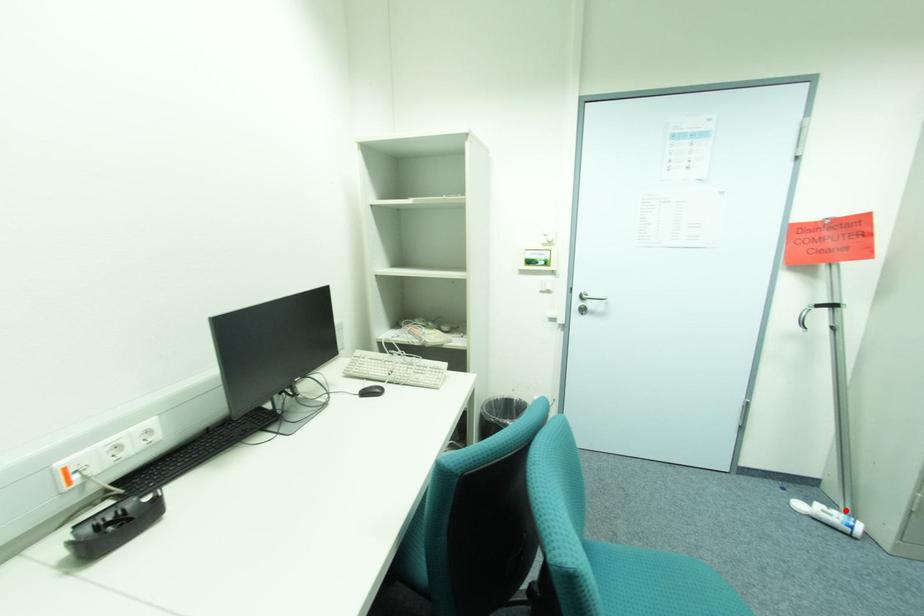
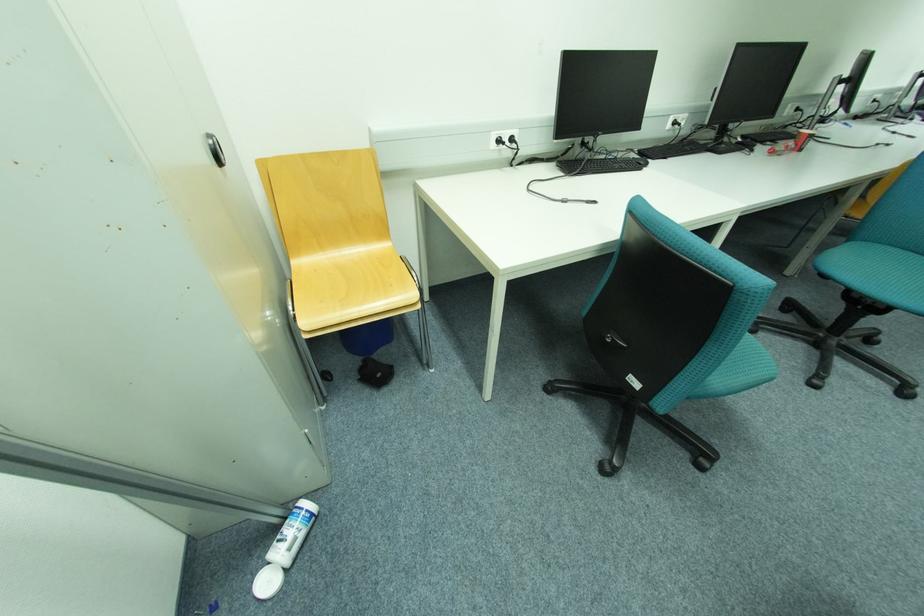
The point at the highlighted location is marked in the first image. Where is the corresponding point in the second image?

(287, 525)